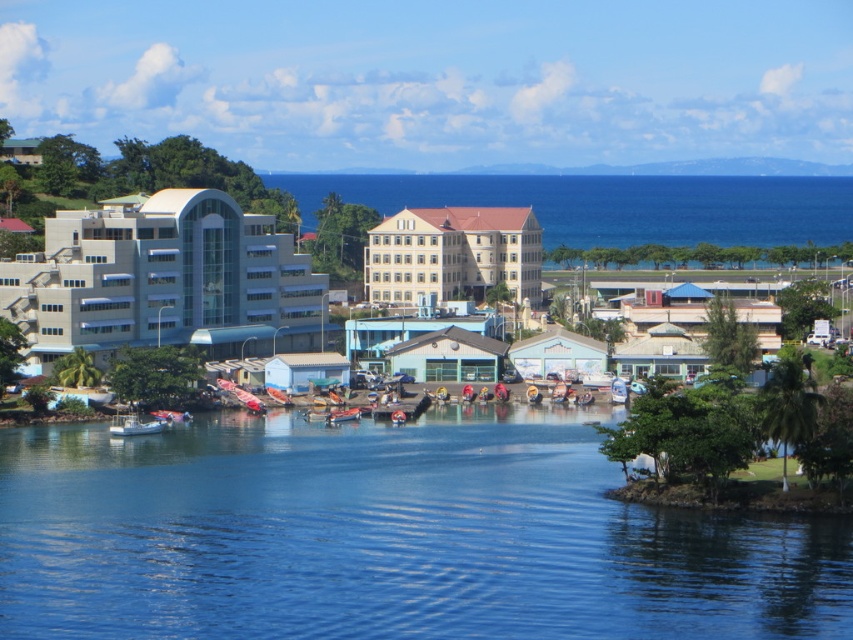
Question: Can you confirm if white smooth building at left is positioned above beige stucco building at center?

Choices:
 (A) yes
 (B) no

Answer: (A)

Question: Which of the following is the farthest from the observer?

Choices:
 (A) 358,410
 (B) 128,420
 (C) 476,256

Answer: (C)

Question: Which point is farther to the camera?

Choices:
 (A) white plastic boat at lower left
 (B) metallic blue boat at center
 (C) white smooth building at left
 (D) clear blue water at center

Answer: (C)

Question: Based on their relative distances, which object is farther from the metallic blue boat at center?

Choices:
 (A) clear blue water at center
 (B) white smooth building at left

Answer: (A)

Question: Can you confirm if clear blue water at center is smaller than metallic blue boat at center?

Choices:
 (A) yes
 (B) no

Answer: (B)

Question: Is beige stucco building at center closer to camera compared to white plastic boat at lower left?

Choices:
 (A) yes
 (B) no

Answer: (B)